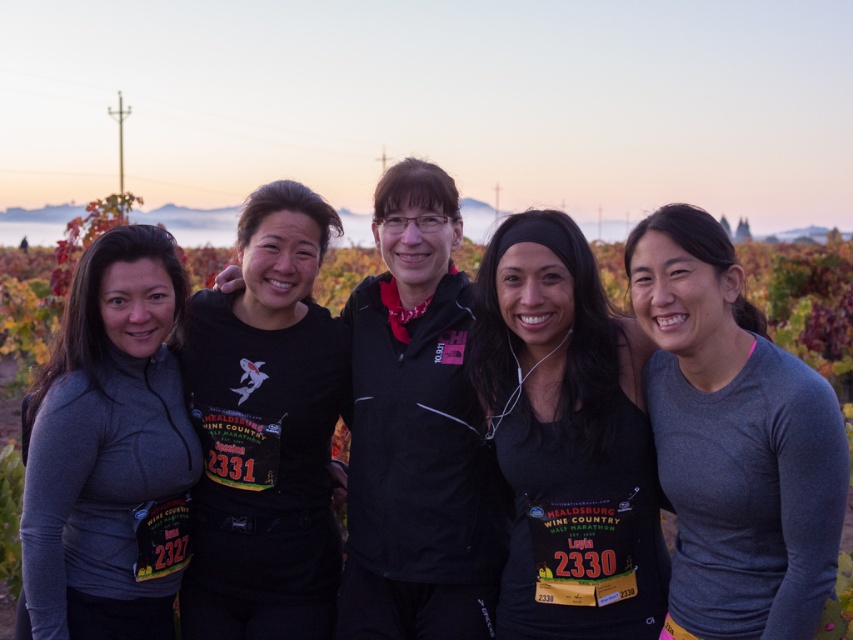
Question: Does gray matte long-sleeve shirt at right appear under black matte jacket at center?

Choices:
 (A) yes
 (B) no

Answer: (A)

Question: Does gray matte long-sleeve shirt at right appear on the right side of black matte shirt at center?

Choices:
 (A) no
 (B) yes

Answer: (B)

Question: Among these points, which one is nearest to the camera?

Choices:
 (A) (386, 346)
 (B) (247, 353)

Answer: (B)

Question: Which is farther from the gray matte long-sleeve shirt at right?

Choices:
 (A) black matte shirt at center
 (B) black matte tank top at center

Answer: (A)

Question: Considering the real-world distances, which object is farthest from the gray matte long-sleeve shirt at right?

Choices:
 (A) black matte tank top at center
 (B) matte gray hoodie at left
 (C) black matte jacket at center
 (D) black matte shirt at center

Answer: (B)

Question: Does black matte tank top at center appear over black matte shirt at center?

Choices:
 (A) no
 (B) yes

Answer: (A)